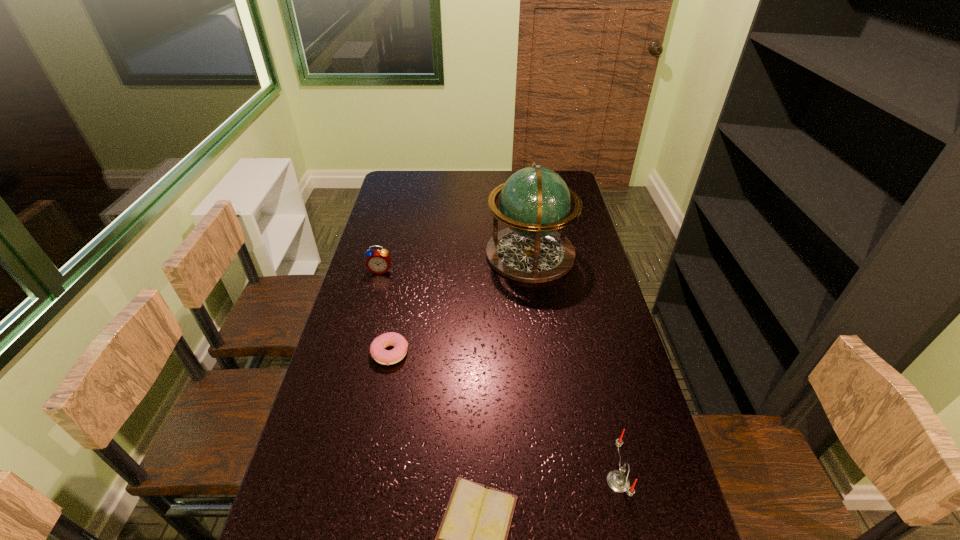
Where is `vacant space positioned on the front-facing side of the candle`? The height and width of the screenshot is (540, 960). vacant space positioned on the front-facing side of the candle is located at coordinates (506, 482).

I want to click on blank area located 0.350m on the front-facing side of the alarm clock, so click(x=359, y=353).

This screenshot has width=960, height=540. What are the coordinates of `vacant space located 0.170m on the right of the doughnut` in the screenshot? It's located at (467, 353).

Identify the location of alarm clock that is at the left edge. The image size is (960, 540). [378, 261].

Find the location of a particular element. doughnut at the left edge is located at coordinates (377, 348).

You are a GUI agent. You are given a task and a screenshot of the screen. Output one action in this format:
    pyautogui.click(x=<x>, y=<y>)
    Task: Click on the globe at the right edge
    Image resolution: width=960 pixels, height=540 pixels.
    Given the screenshot: What is the action you would take?
    pyautogui.click(x=534, y=202)

This screenshot has width=960, height=540. I want to click on candle that is at the right edge, so click(618, 481).

The height and width of the screenshot is (540, 960). In order to click on free region at the far edge of the desktop in this screenshot , I will do `click(434, 185)`.

The width and height of the screenshot is (960, 540). In the image, there is a desktop. Find the location of `vacant space at the left edge`. vacant space at the left edge is located at coordinates (408, 199).

At what (x,y) coordinates should I click in order to perform the action: click on vacant space at the right edge of the desktop. Please return your answer as a coordinate pair (x, y). Image resolution: width=960 pixels, height=540 pixels. Looking at the image, I should click on (575, 351).